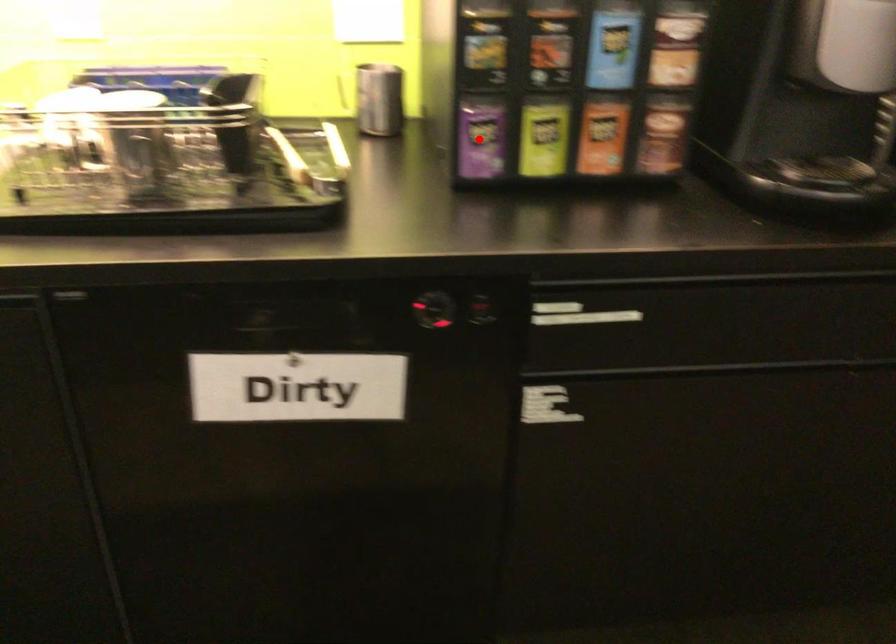
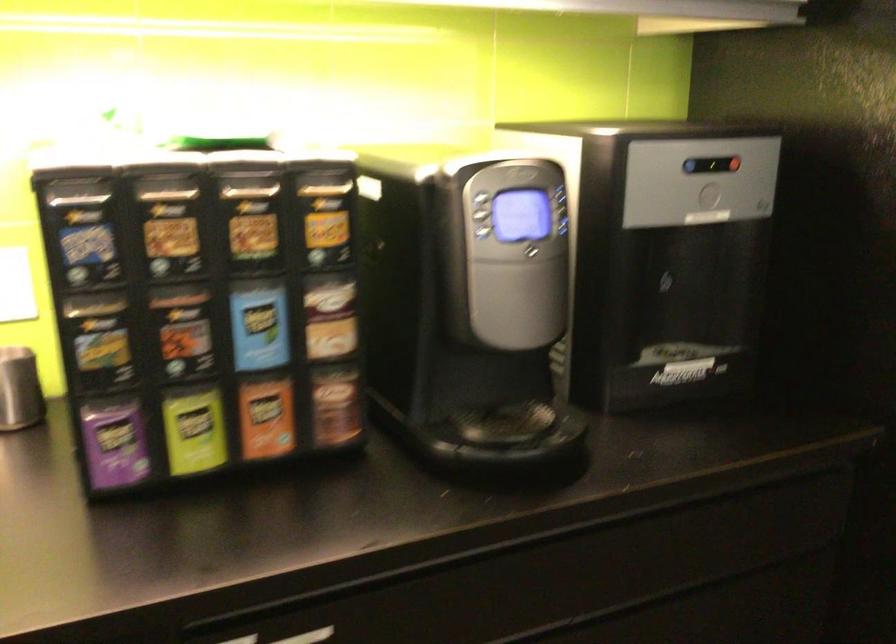
Question: I am providing you with two images of the same scene from different viewpoints. Image1 has a red point marked. In image2, the corresponding 3D location appears at what relative position? Reply with the corresponding letter.

Choices:
 (A) Closer
 (B) Farther

Answer: (A)